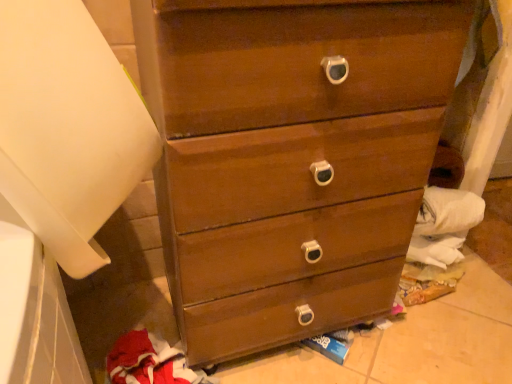
Measure the distance between red fleece sweatshirt at lower left and camera.

red fleece sweatshirt at lower left and camera are 34.09 inches apart.

In order to face matte wood chest of drawers at center, should I rotate leftwards or rightwards?

A 3.806 degree turn to the right will do.

Identify the location of white matte paper towel at left. (67, 128).

Where is `red fleece sweatshirt at lower left`? The image size is (512, 384). red fleece sweatshirt at lower left is located at coordinates (150, 362).

Can you confirm if red fleece sweatshirt at lower left is shorter than white matte paper towel at left?

Indeed, red fleece sweatshirt at lower left has a lesser height compared to white matte paper towel at left.

Would you say red fleece sweatshirt at lower left is inside or outside white matte paper towel at left?

The correct answer is: outside.

Which object is wider, red fleece sweatshirt at lower left or white matte paper towel at left?

With larger width is white matte paper towel at left.

Which is more to the left, red fleece sweatshirt at lower left or white matte paper towel at left?

Positioned to the left is white matte paper towel at left.

Is white matte paper towel at left wider than red fleece sweatshirt at lower left?

Yes, white matte paper towel at left is wider than red fleece sweatshirt at lower left.

Would you say white matte paper towel at left is inside or outside red fleece sweatshirt at lower left?

white matte paper towel at left is located beyond the bounds of red fleece sweatshirt at lower left.

Is white matte paper towel at left in front of or behind red fleece sweatshirt at lower left in the image?

Clearly, white matte paper towel at left is in front of red fleece sweatshirt at lower left.

Looking at this image, what's the angular difference between white matte paper towel at left and red fleece sweatshirt at lower left's facing directions?

white matte paper towel at left and red fleece sweatshirt at lower left are facing 3.89 degrees away from each other.

Between matte wood chest of drawers at center and white matte paper towel at left, which one has larger width?

Wider between the two is white matte paper towel at left.

Is matte wood chest of drawers at center far away from white matte paper towel at left?

Actually, matte wood chest of drawers at center and white matte paper towel at left are a little close together.

Which of these two, matte wood chest of drawers at center or red fleece sweatshirt at lower left, is smaller?

red fleece sweatshirt at lower left is smaller.

The width and height of the screenshot is (512, 384). In order to click on clothing on the left side of matte wood chest of drawers at center in this screenshot , I will do `click(150, 362)`.

Which object is positioned more to the left, matte wood chest of drawers at center or red fleece sweatshirt at lower left?

red fleece sweatshirt at lower left.

Measure the distance between red fleece sweatshirt at lower left and matte wood chest of drawers at center.

red fleece sweatshirt at lower left and matte wood chest of drawers at center are 16.03 inches apart.

Which is in front, point (145, 337) or point (247, 161)?

The point (247, 161) is closer to the camera.

In the scene shown: Can we say red fleece sweatshirt at lower left lies outside matte wood chest of drawers at center?

red fleece sweatshirt at lower left is positioned outside matte wood chest of drawers at center.

Is red fleece sweatshirt at lower left oriented away from matte wood chest of drawers at center?

No, red fleece sweatshirt at lower left is not facing away from matte wood chest of drawers at center.

Can you confirm if white matte paper towel at left is thinner than matte wood chest of drawers at center?

Incorrect, the width of white matte paper towel at left is not less than that of matte wood chest of drawers at center.

Is white matte paper towel at left shorter than matte wood chest of drawers at center?

Yes.

Find the location of a particular element. This screenshot has width=512, height=384. paper towel to the left of matte wood chest of drawers at center is located at coordinates (67, 128).

Is white matte paper towel at left not near matte wood chest of drawers at center?

Actually, white matte paper towel at left and matte wood chest of drawers at center are a little close together.

I want to click on paper towel that appears in front of the red fleece sweatshirt at lower left, so click(67, 128).

In the image, there is a white matte paper towel at left. Where is `clothing below it (from the image's perspective)`? clothing below it (from the image's perspective) is located at coordinates (150, 362).

From the image, which object appears to be nearer to matte wood chest of drawers at center, white matte paper towel at left or red fleece sweatshirt at lower left?

Among the two, white matte paper towel at left is located nearer to matte wood chest of drawers at center.

Looking at the image, which one is located closer to white matte paper towel at left, matte wood chest of drawers at center or red fleece sweatshirt at lower left?

Among the two, matte wood chest of drawers at center is located nearer to white matte paper towel at left.

In the scene shown: Based on their spatial positions, is white matte paper towel at left or matte wood chest of drawers at center closer to red fleece sweatshirt at lower left?

matte wood chest of drawers at center is closer to red fleece sweatshirt at lower left.

Estimate the real-world distances between objects in this image. Which object is closer to white matte paper towel at left, red fleece sweatshirt at lower left or matte wood chest of drawers at center?

matte wood chest of drawers at center is positioned closer to the anchor white matte paper towel at left.

Considering their positions, is red fleece sweatshirt at lower left positioned closer to matte wood chest of drawers at center than white matte paper towel at left?

Among the two, white matte paper towel at left is located nearer to matte wood chest of drawers at center.

Consider the image. From the image, which object appears to be nearer to red fleece sweatshirt at lower left, matte wood chest of drawers at center or white matte paper towel at left?

Based on the image, matte wood chest of drawers at center appears to be nearer to red fleece sweatshirt at lower left.

Locate an element on the screen. Image resolution: width=512 pixels, height=384 pixels. chest of drawers between white matte paper towel at left and red fleece sweatshirt at lower left in the vertical direction is located at coordinates (296, 159).